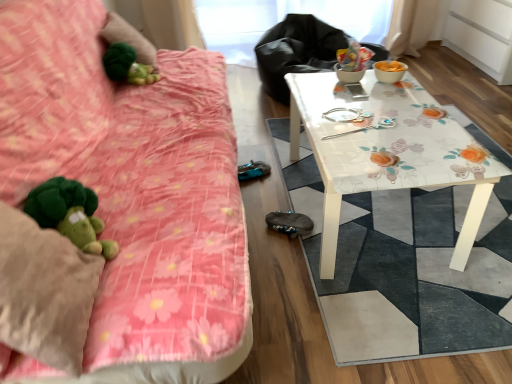
This screenshot has width=512, height=384. Find the location of `vacant space to the left of metallic silver spoon at center`. vacant space to the left of metallic silver spoon at center is located at coordinates (324, 129).